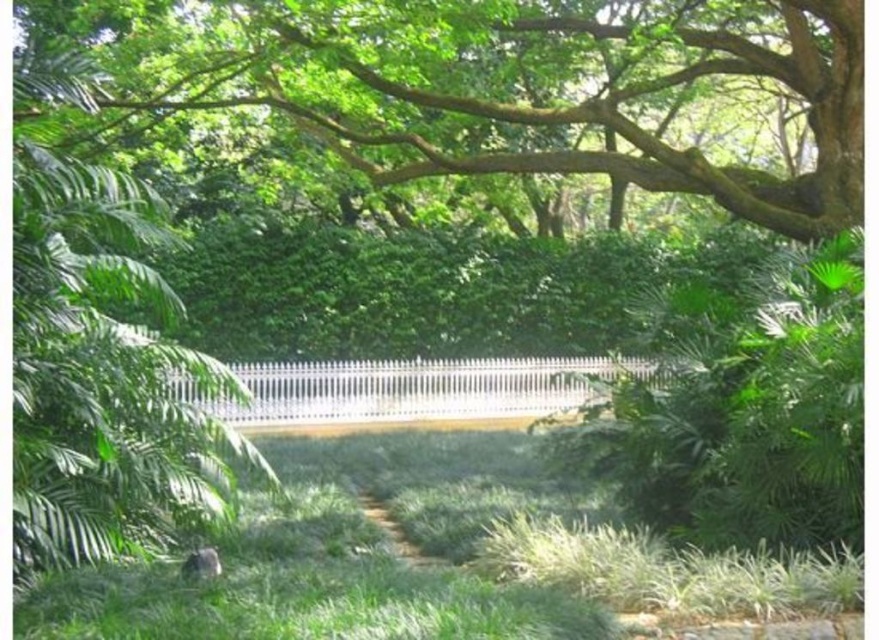
Between green leafy tree at center and green leafy tree at upper center, which one has more height?

green leafy tree at upper center

Which is more to the right, green leafy tree at center or green leafy tree at upper center?

green leafy tree at upper center is more to the right.

Is point (149, 515) farther from camera compared to point (590, 118)?

That is False.

Image resolution: width=879 pixels, height=640 pixels. In order to click on green leafy tree at center in this screenshot , I will do `click(98, 353)`.

From the picture: Can you confirm if green leafy tree at center is positioned above green grass at center?

Yes, green leafy tree at center is above green grass at center.

Find the location of a particular element. Image resolution: width=879 pixels, height=640 pixels. green leafy tree at center is located at coordinates (98, 353).

You are a GUI agent. You are given a task and a screenshot of the screen. Output one action in this format:
    pyautogui.click(x=<x>, y=<y>)
    Task: Click on the green leafy tree at center
    The width and height of the screenshot is (879, 640).
    Given the screenshot: What is the action you would take?
    pyautogui.click(x=98, y=353)

Is green grass at center above green leafy tree at upper center?

No, green grass at center is not above green leafy tree at upper center.

Can you confirm if green grass at center is bigger than green leafy tree at upper center?

Actually, green grass at center might be smaller than green leafy tree at upper center.

Measure the distance between point (394,442) and camera.

They are 49.37 feet apart.

The width and height of the screenshot is (879, 640). Find the location of `green grass at center`. green grass at center is located at coordinates (344, 554).